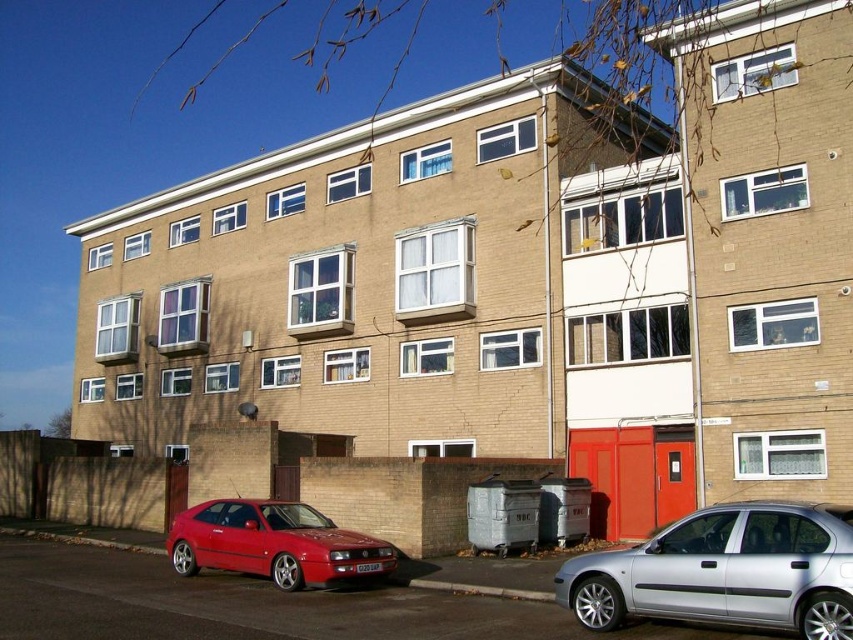
You are a delivery person with a cart that is 3 meters wide. You need to move your cart between the silver metallic sedan at lower right and the glossy red car at lower left. Is there enough space for your cart to pass through?

The distance between the silver metallic sedan at lower right and the glossy red car at lower left is 6.23 meters. Since the cart is 3 meters wide, there is sufficient space for the cart to pass through.

You are a delivery person trying to park your van between the silver metallic sedan at lower right and the glossy red car at lower left. Your van is 2 meters tall. Can you fit your van between them without hitting the roof?

The silver metallic sedan at lower right is taller than the glossy red car at lower left. Since the tallest vehicle there is the silver metallic sedan at lower right, and your van is 2 meters tall, you need to check if the height between the two cars allows clearance. However, the description only mentions the relative height between the two cars, not the actual space between them. Without knowing the distance between the cars or the available vertical clearance, it is impossible to determine if the van can

You are standing at the center of the paved area in front of the building and want to move towards the silver metallic sedan at lower right. Which direction should you walk to reach it?

The silver metallic sedan at lower right is located at point (724, 572) in 2D coordinates, so you should walk towards the lower right direction to reach it.